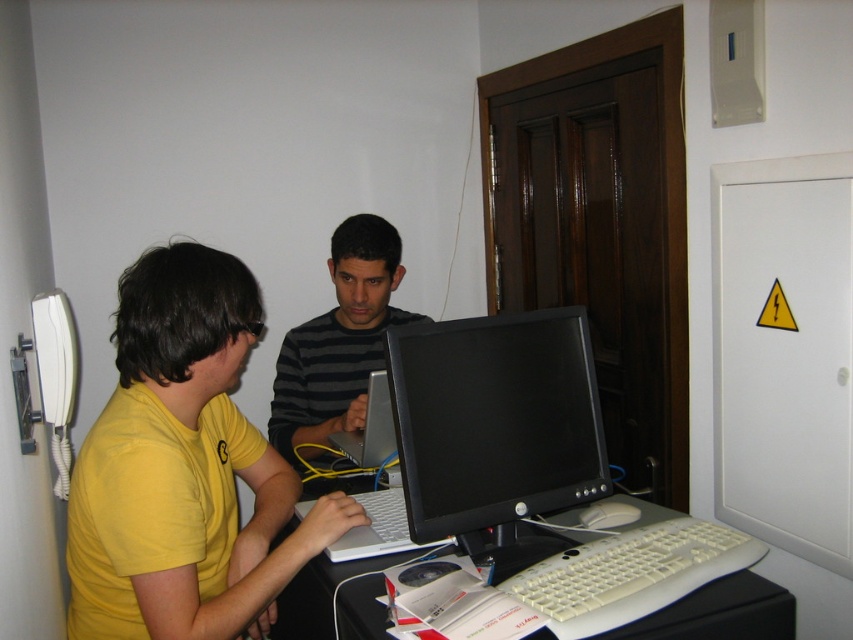
You are a delivery person who needs to place a small package on the desk without blocking either person. The package will occupy a space at point coordinates (494, 419). Is this location safe to place the package?

The point coordinates (494, 419) corresponds to the black glossy monitor at center, which is an occupied space. Placing the package here would block the monitor and interfere with the person using it.

You are trying to determine which object is taller between the black glossy monitor at center and the white plastic computer desk at center. Based on the scene description, which one is taller?

The black glossy monitor at center is taller than the white plastic computer desk at center according to the description.

Where is the black glossy monitor at center located in the image?

The black glossy monitor at center is located at point 0.656 on the x axis and 0.580 on the y axis.